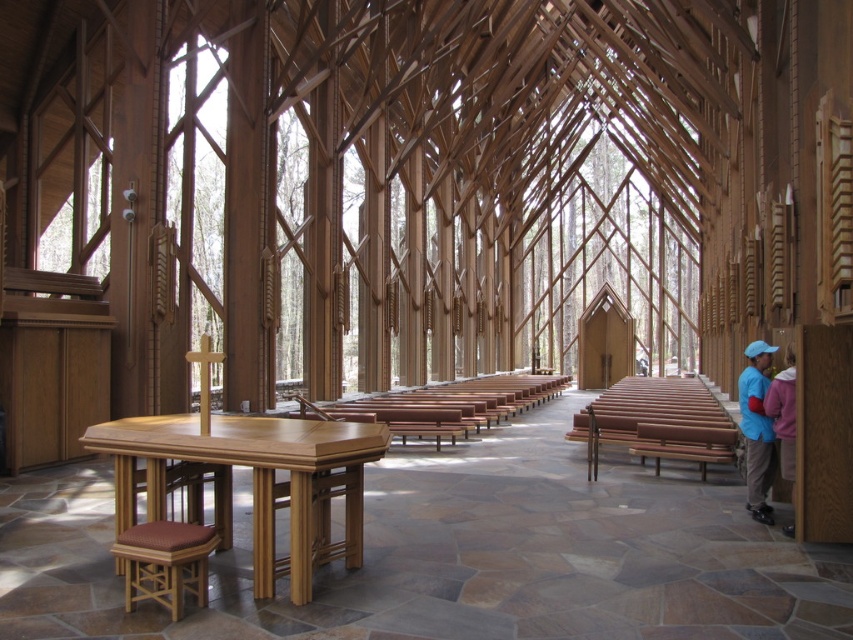
Question: Does brown polished wood bench at right have a smaller size compared to blue fabric jacket at lower right?

Choices:
 (A) yes
 (B) no

Answer: (B)

Question: Which object appears farthest from the camera in this image?

Choices:
 (A) wooden cushioned stool at lower left
 (B) blue fabric jacket at right
 (C) blue fabric jacket at lower right

Answer: (B)

Question: Can you confirm if brown polished wood bench at right is thinner than wooden cushioned stool at lower left?

Choices:
 (A) no
 (B) yes

Answer: (A)

Question: Does light brown wood table at center have a greater width compared to blue fabric jacket at lower right?

Choices:
 (A) no
 (B) yes

Answer: (B)

Question: Which of the following is the closest to the observer?

Choices:
 (A) (780, 417)
 (B) (744, 452)
 (C) (645, 384)

Answer: (A)

Question: Which of the following is the closest to the observer?

Choices:
 (A) (706, 406)
 (B) (791, 435)
 (C) (134, 490)

Answer: (C)